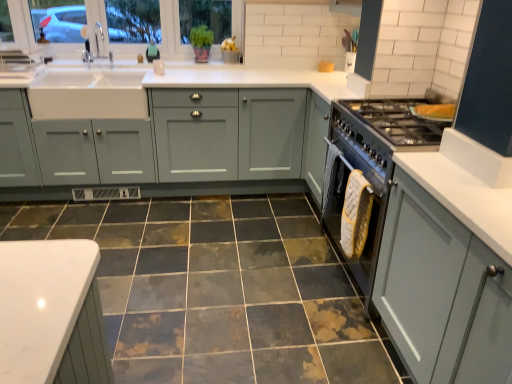
Question: Would you say clear glass window at upper left is to the left or to the right of stainless steel oven at right in the picture?

Choices:
 (A) right
 (B) left

Answer: (B)

Question: Is point (168, 46) positioned closer to the camera than point (380, 225)?

Choices:
 (A) closer
 (B) farther

Answer: (B)

Question: Which object is the closest to the marbled ceramic tile at center?

Choices:
 (A) stainless steel oven at right
 (B) clear glass window at upper left
 (C) matte gray cabinets at center, the 2th cabinetry when ordered from bottom to top
 (D) teal matte soap dispenser at upper center
 (E) matte gray cabinet at right, which appears as the 2th cabinetry when viewed from the back

Answer: (C)

Question: Which is farther from the marbled ceramic tile at center?

Choices:
 (A) clear glass window at upper left
 (B) teal matte soap dispenser at upper center
 (C) matte gray cabinet at right, the 1th cabinetry in the front-to-back sequence
 (D) matte gray cabinets at center, the 1th cabinetry viewed from the left
 (E) stainless steel oven at right

Answer: (B)